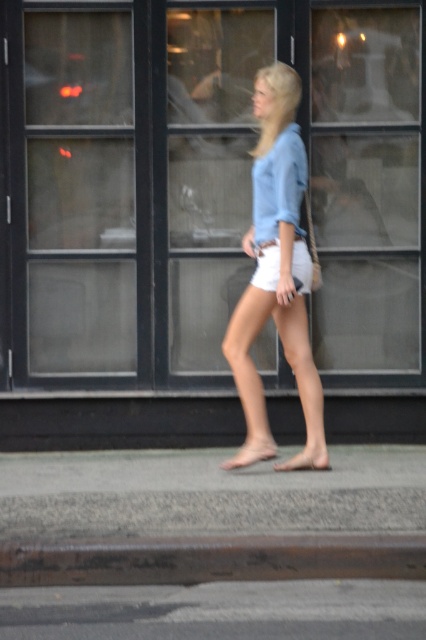
Question: From the image, what is the correct spatial relationship of gray concrete pavement at lower center in relation to gray asphalt at lower center?

Choices:
 (A) above
 (B) below

Answer: (A)

Question: Estimate the real-world distances between objects in this image. Which object is farther from the matte beige sandal at lower center?

Choices:
 (A) white cotton shorts at center
 (B) rusty metal curb at lower center
 (C) gray asphalt at lower center
 (D) transparent glass shop window at center

Answer: (D)

Question: Is gray asphalt at lower center below white cotton shorts at center?

Choices:
 (A) no
 (B) yes

Answer: (B)

Question: In this image, where is gray concrete pavement at lower center located relative to matte beige sandal at lower center?

Choices:
 (A) right
 (B) left

Answer: (B)

Question: Estimate the real-world distances between objects in this image. Which object is farther from the gray asphalt at lower center?

Choices:
 (A) matte beige sandal at lower center
 (B) white cotton shorts at center
 (C) transparent glass shop window at center

Answer: (C)

Question: Which point is farther from the camera taking this photo?

Choices:
 (A) (112, 564)
 (B) (271, 280)
 (C) (261, 449)

Answer: (C)